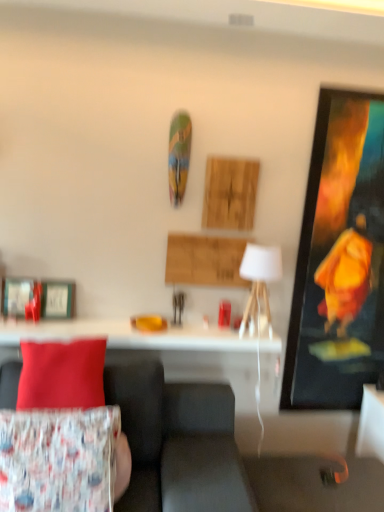
Question: From a real-world perspective, relative to floral fabric cushion at lower left, the 2th pillow positioned from the top, is matte red pillow at left, acting as the 2th pillow starting from the bottom, vertically above or below?

Choices:
 (A) above
 (B) below

Answer: (A)

Question: In terms of height, does matte red pillow at left, which is counted as the 1th pillow, starting from the top, look taller or shorter compared to floral fabric cushion at lower left, the 2th pillow positioned from the top?

Choices:
 (A) tall
 (B) short

Answer: (B)

Question: Estimate the real-world distances between objects in this image. Which object is closer to the white fabric lampshade at center?

Choices:
 (A) white glossy table at center
 (B) floral fabric cushion at lower left, the first pillow when ordered from bottom to top
 (C) velvet fabric couch at lower left
 (D) metallic silver picture frame at left
 (E) printed fabric cushion at lower left

Answer: (A)

Question: Estimate the real-world distances between objects in this image. Which object is closer to the printed fabric cushion at lower left?

Choices:
 (A) matte red pillow at left, which is counted as the 1th pillow, starting from the top
 (B) white fabric lampshade at center
 (C) white glossy table at center
 (D) floral fabric cushion at lower left, the first pillow when ordered from bottom to top
 (E) metallic silver picture frame at left

Answer: (A)